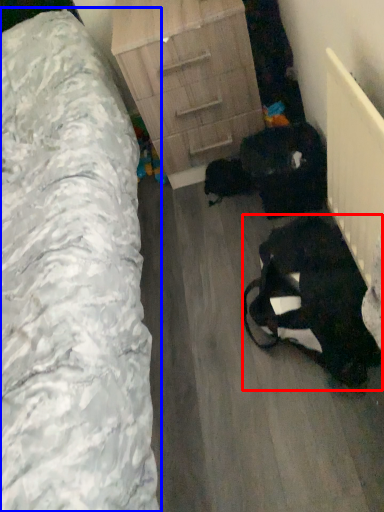
Question: Which of the following is the farthest to the observer, animal (highlighted by a red box) or furniture (highlighted by a blue box)?

Choices:
 (A) animal
 (B) furniture

Answer: (A)